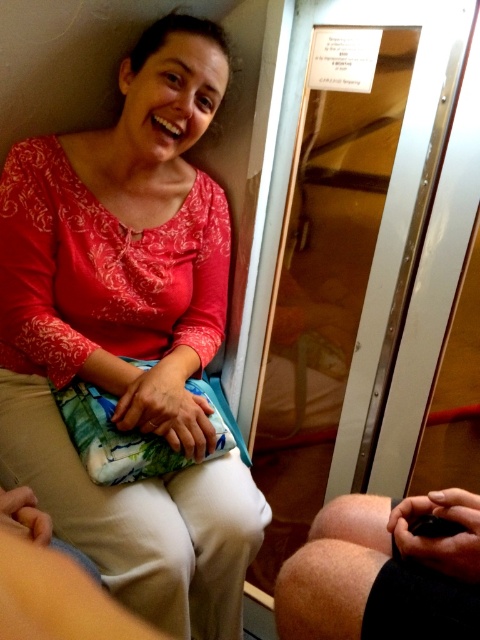
Who is more distant from viewer, (33, 362) or (369, 595)?

Positioned behind is point (33, 362).

Which is more to the right, matte floral skirt at center or hairy skin at lower right?

hairy skin at lower right

Measure the distance between point [38,356] and camera.

Point [38,356] and camera are 3.83 feet apart.

Where is `matte floral skirt at center`? Image resolution: width=480 pixels, height=640 pixels. matte floral skirt at center is located at coordinates (130, 333).